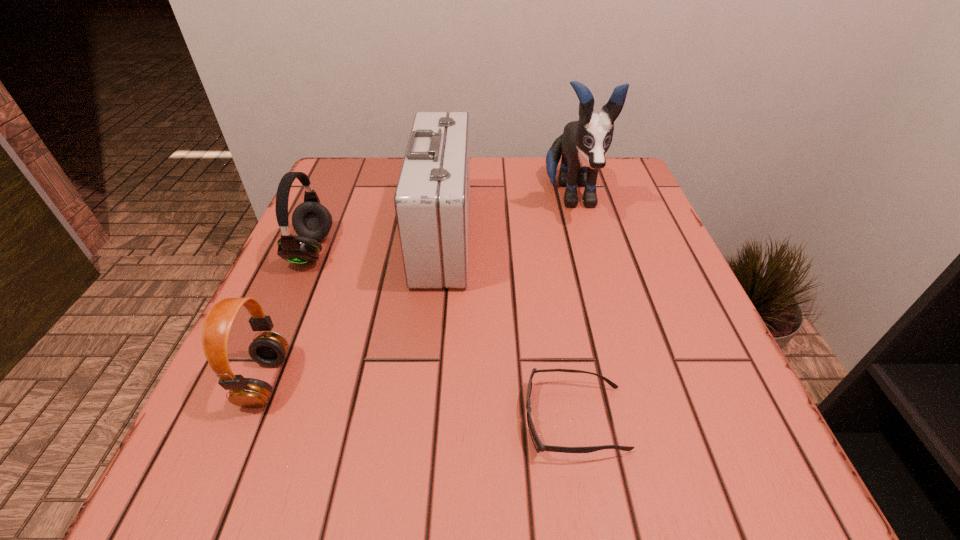
Find the location of a particular element. The width and height of the screenshot is (960, 540). vacant region between the farther headset and the sunglasses is located at coordinates (444, 334).

Locate an element on the screen. This screenshot has height=540, width=960. free spot between the shortest object and the third object from right to left is located at coordinates (509, 327).

Where is `free space between the sunglasses and the third object from left to right`? This screenshot has height=540, width=960. free space between the sunglasses and the third object from left to right is located at coordinates (509, 327).

What are the coordinates of `the third closest object relative to the nearer headset` in the screenshot? It's located at (539, 447).

Select which object appears as the closest to the tallest object. Please provide its 2D coordinates. Your answer should be formatted as a tuple, i.e. [(x, y)], where the tuple contains the x and y coordinates of a point satisfying the conditions above.

[(432, 199)]

This screenshot has height=540, width=960. Identify the location of free space that satisfies the following two spatial constraints: 1. on the front-facing side of the puppy; 2. on the front-facing side of the first-aid kit. (582, 236).

I want to click on vacant point that satisfies the following two spatial constraints: 1. on the front-facing side of the tallest object; 2. on the front-facing side of the fourth shortest object, so click(582, 236).

Image resolution: width=960 pixels, height=540 pixels. I want to click on free point that satisfies the following two spatial constraints: 1. on the front-facing side of the puppy; 2. on the front-facing side of the shortest object, so (633, 419).

I want to click on vacant space that satisfies the following two spatial constraints: 1. on the front-facing side of the tallest object; 2. on the front-facing side of the second tallest object, so click(x=582, y=236).

This screenshot has height=540, width=960. I want to click on free region that satisfies the following two spatial constraints: 1. on the front-facing side of the puppy; 2. on the ear cups of the nearer headset, so click(622, 381).